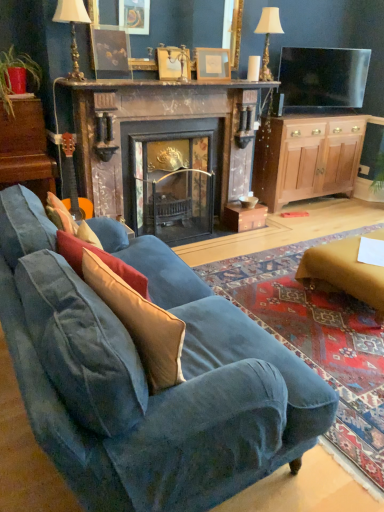
Question: Should I look upward or downward to see wooden dresser at left?

Choices:
 (A) down
 (B) up

Answer: (B)

Question: From the image's perspective, would you say wooden cabinet at right is positioned over marble fireplace at center?

Choices:
 (A) yes
 (B) no

Answer: (A)

Question: Is the position of wooden cabinet at right more distant than that of marble fireplace at center?

Choices:
 (A) yes
 (B) no

Answer: (A)

Question: Does wooden cabinet at right appear on the left side of marble fireplace at center?

Choices:
 (A) yes
 (B) no

Answer: (B)

Question: Is wooden cabinet at right oriented towards marble fireplace at center?

Choices:
 (A) no
 (B) yes

Answer: (A)

Question: Is the surface of wooden cabinet at right in direct contact with marble fireplace at center?

Choices:
 (A) yes
 (B) no

Answer: (B)

Question: Does wooden cabinet at right contain marble fireplace at center?

Choices:
 (A) yes
 (B) no

Answer: (B)

Question: Considering the relative sizes of matte gold picture frame at upper center, the second picture frame when ordered from left to right, and matte wooden picture frame at upper center, placed as the third picture frame when sorted from left to right, in the image provided, is matte gold picture frame at upper center, the second picture frame when ordered from left to right, thinner than matte wooden picture frame at upper center, placed as the third picture frame when sorted from left to right,?

Choices:
 (A) no
 (B) yes

Answer: (A)

Question: Considering the relative positions of matte gold picture frame at upper center, the second picture frame when ordered from left to right, and matte wooden picture frame at upper center, placed as the third picture frame when sorted from left to right, in the image provided, is matte gold picture frame at upper center, the second picture frame when ordered from left to right, to the left of matte wooden picture frame at upper center, placed as the third picture frame when sorted from left to right, from the viewer's perspective?

Choices:
 (A) yes
 (B) no

Answer: (A)

Question: Is matte gold picture frame at upper center, the second picture frame when ordered from left to right, outside matte wooden picture frame at upper center, arranged as the first picture frame when viewed from the right?

Choices:
 (A) no
 (B) yes

Answer: (B)

Question: Is matte gold picture frame at upper center, the second picture frame when ordered from left to right, in contact with matte wooden picture frame at upper center, arranged as the first picture frame when viewed from the right?

Choices:
 (A) yes
 (B) no

Answer: (B)

Question: Considering the relative sizes of matte gold picture frame at upper center, the second picture frame when ordered from left to right, and matte wooden picture frame at upper center, arranged as the first picture frame when viewed from the right, in the image provided, is matte gold picture frame at upper center, the second picture frame when ordered from left to right, bigger than matte wooden picture frame at upper center, arranged as the first picture frame when viewed from the right,?

Choices:
 (A) no
 (B) yes

Answer: (A)

Question: Considering the relative sizes of matte gold picture frame at upper center, which is the second picture frame in right-to-left order, and matte wooden picture frame at upper center, arranged as the first picture frame when viewed from the right, in the image provided, is matte gold picture frame at upper center, which is the second picture frame in right-to-left order, shorter than matte wooden picture frame at upper center, arranged as the first picture frame when viewed from the right,?

Choices:
 (A) yes
 (B) no

Answer: (A)

Question: From a real-world perspective, is wooden dresser at left on top of matte gold picture frame at upper center, the second picture frame when ordered from left to right?

Choices:
 (A) no
 (B) yes

Answer: (A)